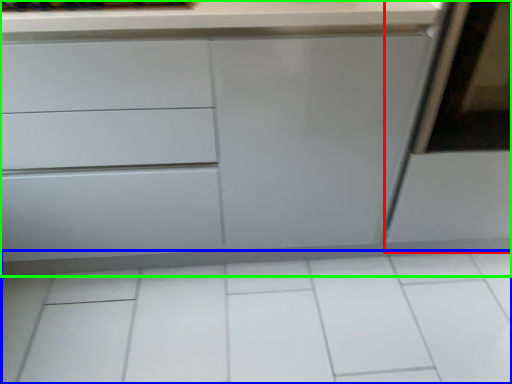
Question: Which is farther away from screen door (highlighted by a red box)? ceramic tile (highlighted by a blue box) or chest of drawers (highlighted by a green box)?

Choices:
 (A) ceramic tile
 (B) chest of drawers

Answer: (A)